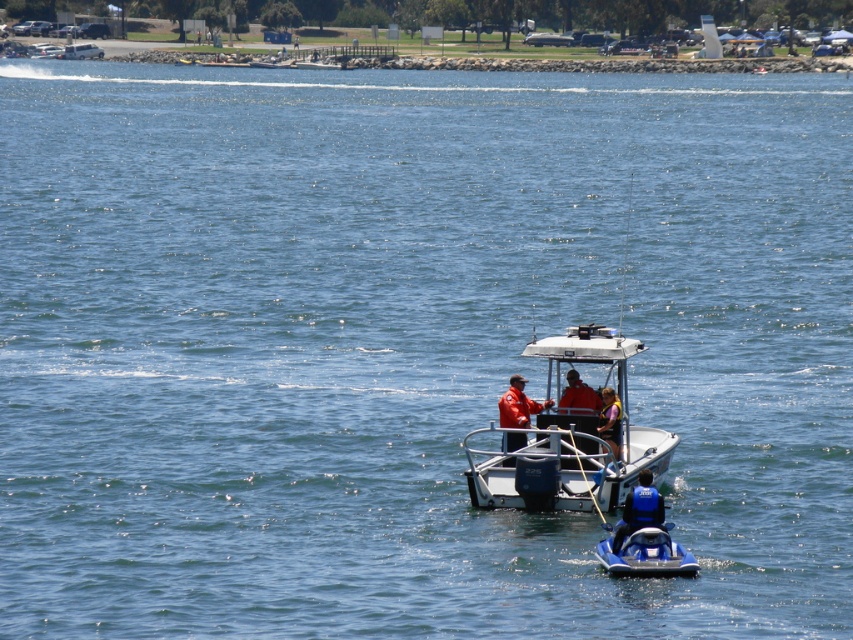
You are a safety inspector on the water. You need to ensure that all watercraft maintain a minimum distance of 10 feet from each other for safety. You observe the blue glossy jet ski at center and the orange life vest at center. Are they within the required safety distance?

The blue glossy jet ski at center is 11.43 feet from the orange life vest at center. Since 11.43 feet is greater than the required 10 feet minimum distance, they are within the required safety distance.

You are navigating a small motorboat with a canopy and need to avoid the blue glossy jet ski at center. Based on the coordinates provided in the scene description, can you determine the direction you should steer to safely pass the jet ski?

The blue glossy jet ski at center is located at point coordinates, so steering the motorboat to the left or right would help avoid collision based on its position relative to your current path.

You are a safety inspector checking the visibility of life vests on a boat. You see the silver metallic boat at center and the purple fabric life vest at center. Which object is taller?

The silver metallic boat at center is taller than the purple fabric life vest at center according to the description.